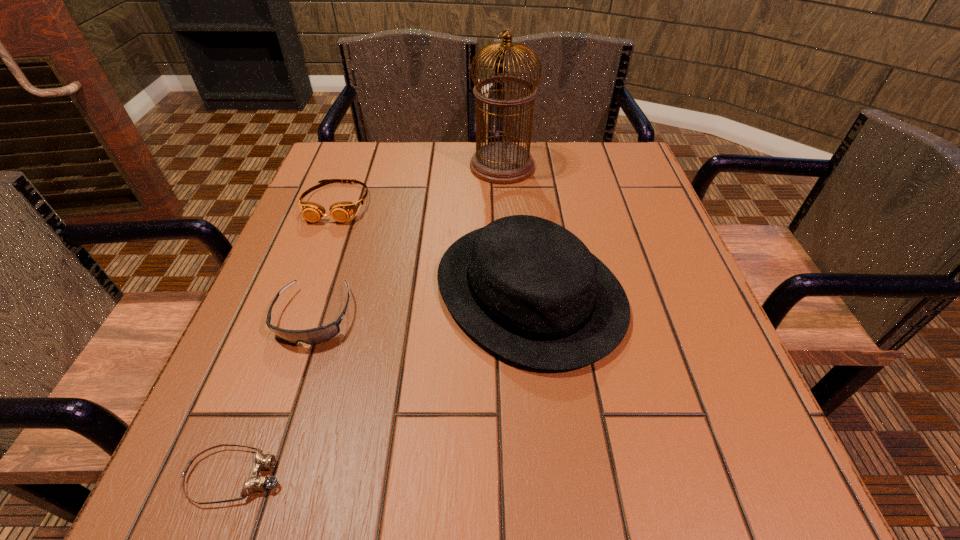
Find the location of `the tallest object`. the tallest object is located at coordinates (501, 162).

Identify the location of fedora. (529, 290).

At what (x,y) coordinates should I click in order to perform the action: click on the farthest goggles. Please return your answer as a coordinate pair (x, y). Looking at the image, I should click on [x=341, y=211].

At what (x,y) coordinates should I click in order to perform the action: click on the second farthest goggles. Please return your answer as a coordinate pair (x, y). This screenshot has width=960, height=540. Looking at the image, I should click on (314, 336).

Identify the location of the shortest goggles. (255, 483).

Find the location of a particular element. This screenshot has height=540, width=960. the nearest goggles is located at coordinates [x=255, y=483].

The height and width of the screenshot is (540, 960). In order to click on free space located 0.140m on the front-facing side of the tallest object in this screenshot , I will do `click(416, 166)`.

Locate an element on the screen. The height and width of the screenshot is (540, 960). free location located 0.050m on the front-facing side of the tallest object is located at coordinates (450, 166).

The width and height of the screenshot is (960, 540). Identify the location of free space located 0.290m on the front-facing side of the tallest object. (358, 166).

The height and width of the screenshot is (540, 960). Identify the location of vacant area situated on the front of the fourth shortest object. (545, 442).